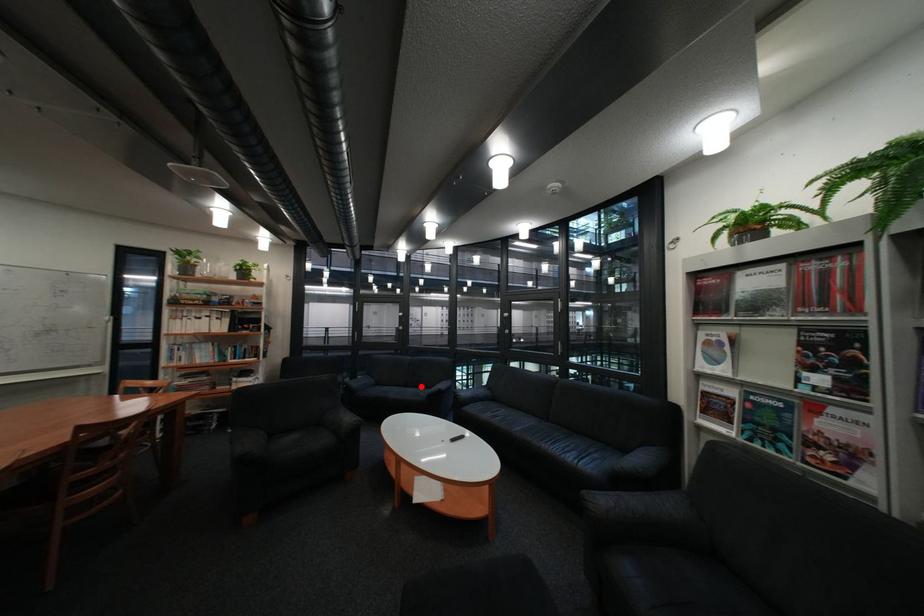
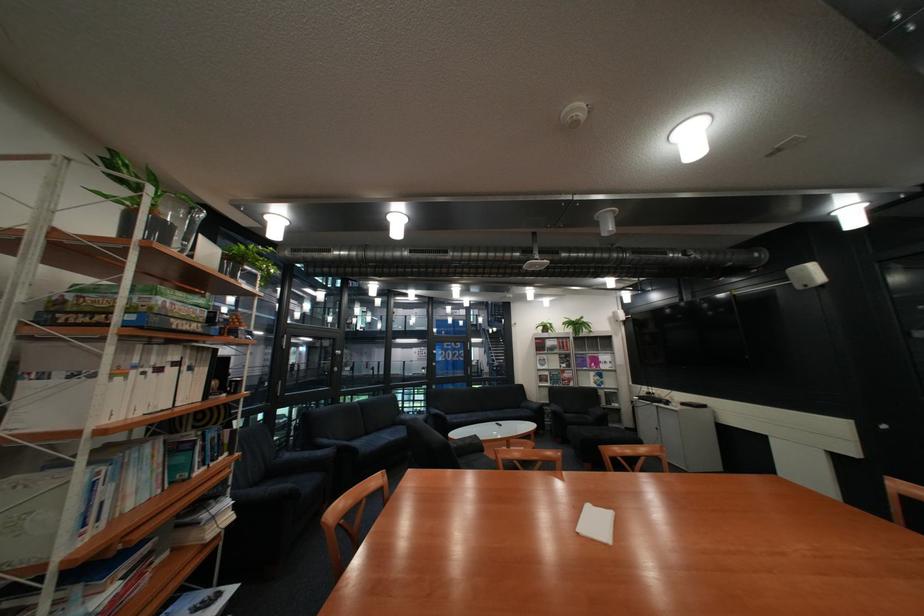
Question: I am providing you with two images of the same scene from different viewpoints. Image1 has a red point marked. In image2, the corresponding 3D location appears at what relative position? Reply with the corresponding letter.

Choices:
 (A) Closer
 (B) Farther

Answer: (A)